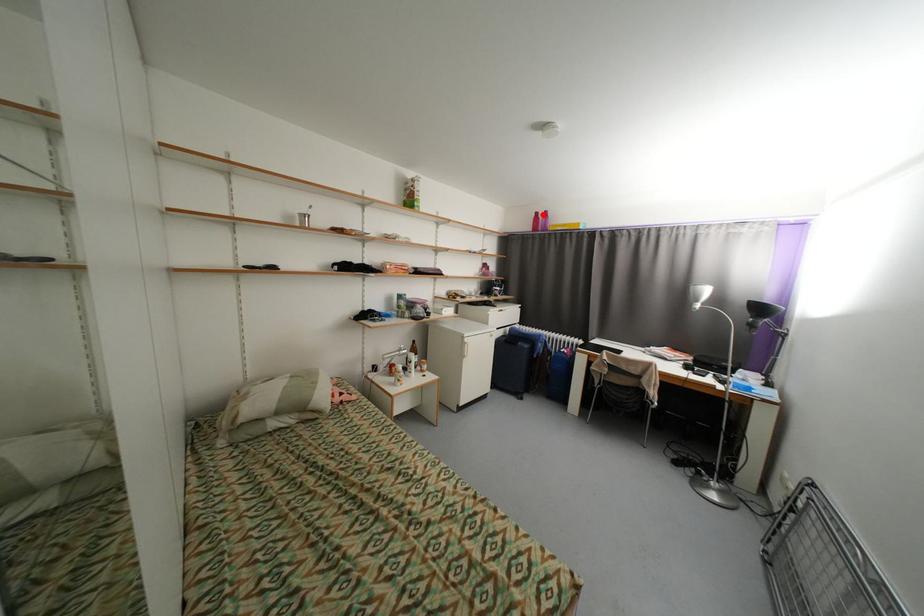
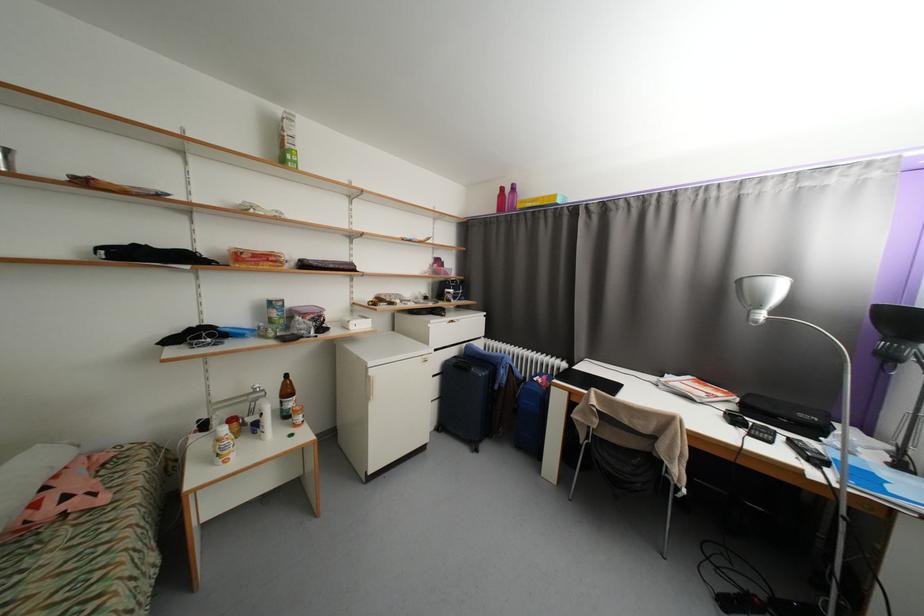
Find the pixel in the second image that matches the highlighted location in the first image.

(508, 190)